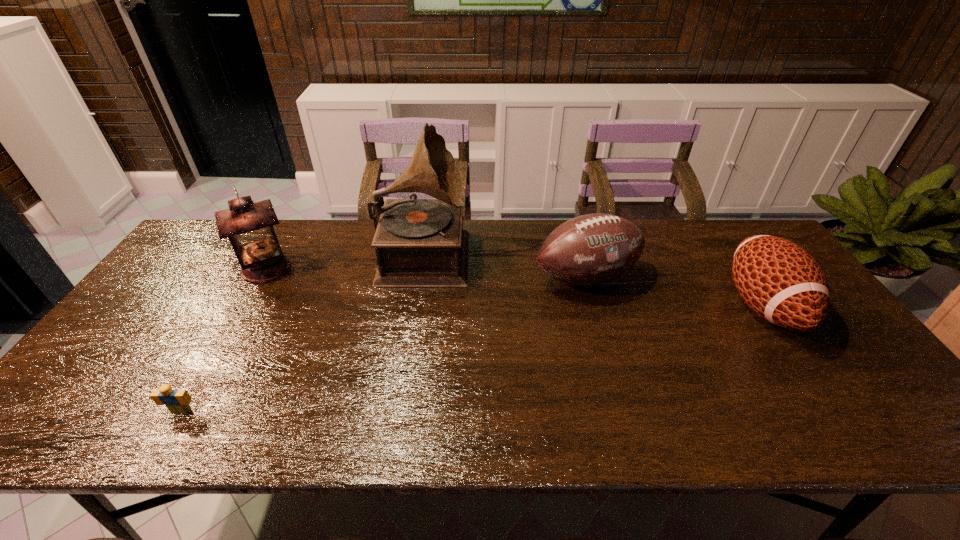
Where is `free spot that satisfies the following two spatial constraints: 1. from the horn of the third object from right to left; 2. on the face of the nearest object`? This screenshot has height=540, width=960. free spot that satisfies the following two spatial constraints: 1. from the horn of the third object from right to left; 2. on the face of the nearest object is located at coordinates (399, 411).

You are a GUI agent. You are given a task and a screenshot of the screen. Output one action in this format:
    pyautogui.click(x=<x>, y=<y>)
    Task: Click on the free space in the image that satisfies the following two spatial constraints: 1. from the horn of the right football; 2. on the left side of the tallest object
    The image size is (960, 540).
    Given the screenshot: What is the action you would take?
    pyautogui.click(x=416, y=306)

I want to click on vacant space that satisfies the following two spatial constraints: 1. from the horn of the left football; 2. on the right side of the tallest object, so (420, 278).

Where is `free region that satisfies the following two spatial constraints: 1. from the horn of the record player; 2. on the face of the nearest object`? The height and width of the screenshot is (540, 960). free region that satisfies the following two spatial constraints: 1. from the horn of the record player; 2. on the face of the nearest object is located at coordinates (399, 411).